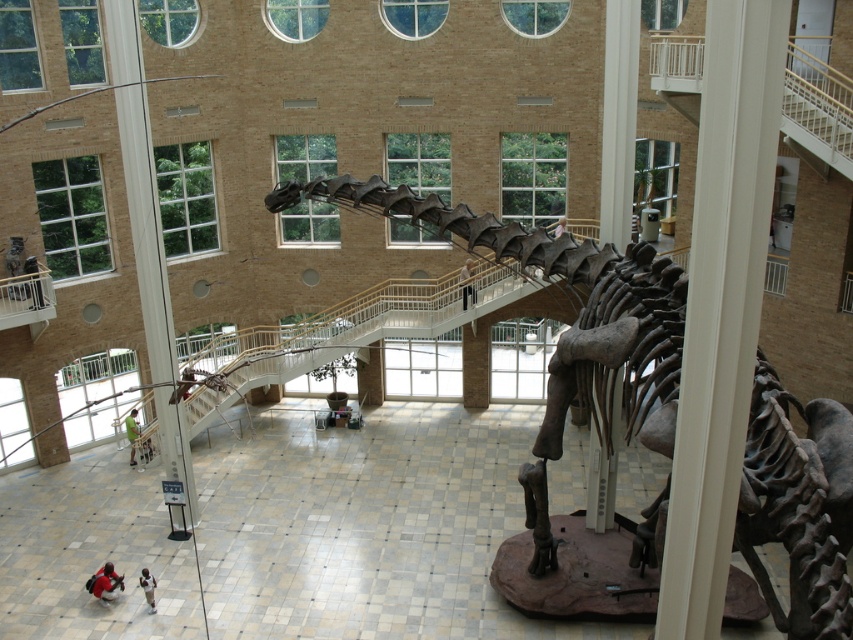
Question: Is white cotton pants at lower left above green fabric person at lower left?

Choices:
 (A) yes
 (B) no

Answer: (B)

Question: Which of the following is the farthest from the observer?

Choices:
 (A) (465, 304)
 (B) (129, 433)
 (C) (144, 586)
 (D) (114, 573)

Answer: (B)

Question: Which object is closer to the camera taking this photo?

Choices:
 (A) white cotton shirt at lower left
 (B) gray bone-like skeleton at center
 (C) black fabric pants at center
 (D) white cotton pants at lower left

Answer: (B)

Question: Observing the image, what is the correct spatial positioning of white cotton shirt at lower left in reference to black fabric pants at center?

Choices:
 (A) above
 (B) below

Answer: (B)

Question: Where is white cotton shirt at lower left located in relation to black fabric pants at center in the image?

Choices:
 (A) left
 (B) right

Answer: (A)

Question: Which is farther from the white cotton shirt at lower left?

Choices:
 (A) green fabric person at lower left
 (B) black fabric pants at center
 (C) gray bone-like skeleton at center

Answer: (B)